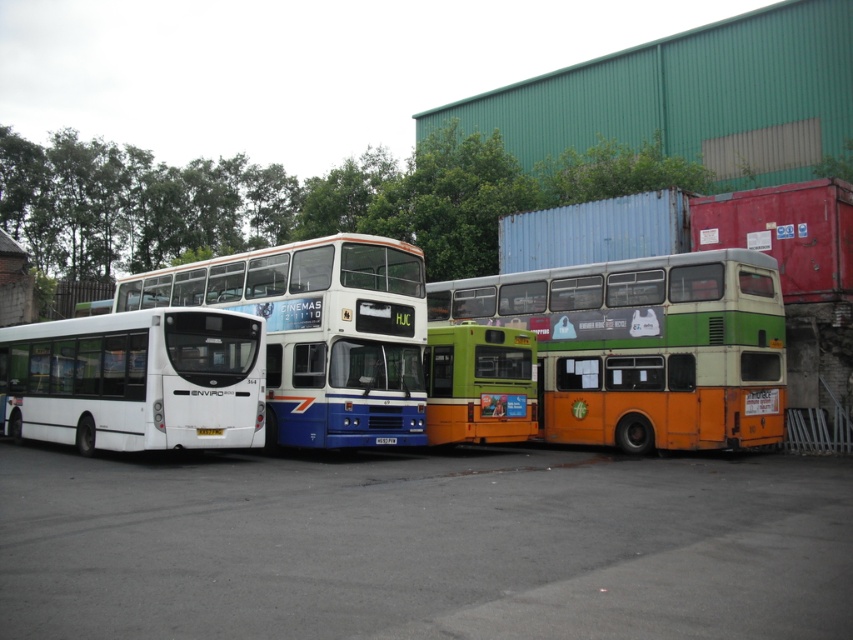
Between white glossy double-decker bus at center and green matte bus at center, which one appears on the right side from the viewer's perspective?

green matte bus at center

Who is positioned more to the left, white glossy double-decker bus at center or green matte bus at center?

white glossy double-decker bus at center is more to the left.

Is point (334, 321) less distant than point (505, 385)?

Yes, it is in front of point (505, 385).

Find the location of `white glossy double-decker bus at center`. white glossy double-decker bus at center is located at coordinates (318, 332).

Based on the photo, which is more to the right, green matte double-decker bus at center or white glossy double-decker bus at center?

Positioned to the right is green matte double-decker bus at center.

Is point (527, 275) closer to viewer compared to point (387, 378)?

That is False.

Describe the element at coordinates (643, 346) in the screenshot. This screenshot has width=853, height=640. I see `green matte double-decker bus at center` at that location.

Identify the location of green matte double-decker bus at center. (643, 346).

Looking at this image, is gray asphalt at center bigger than green matte bus at center?

Yes.

Who is taller, gray asphalt at center or green matte bus at center?

green matte bus at center

Image resolution: width=853 pixels, height=640 pixels. Identify the location of gray asphalt at center. (422, 545).